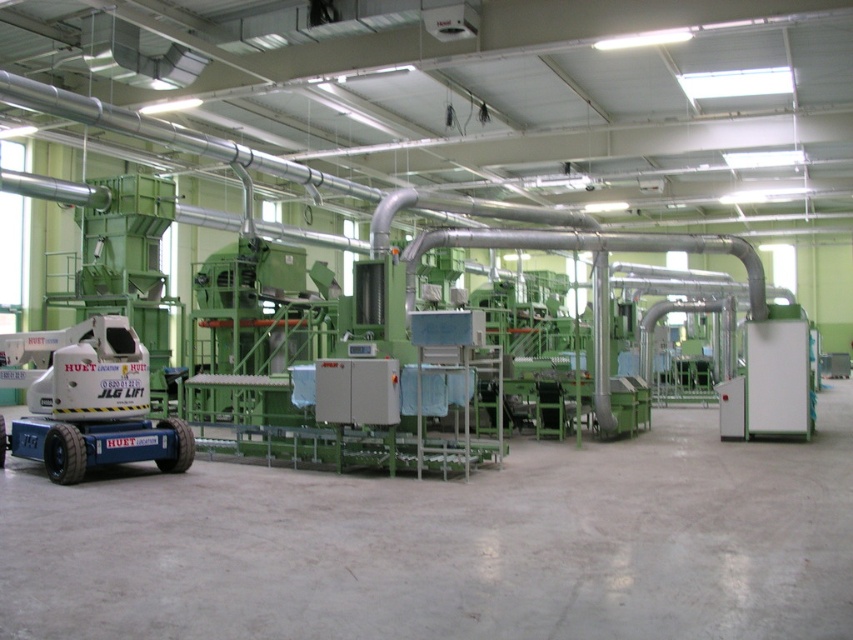
Is point (56, 392) in front of point (717, 241)?

Yes, it is.

Does white plastic lift at left appear on the right side of metallic silver pipe at center?

No, white plastic lift at left is not to the right of metallic silver pipe at center.

Describe the element at coordinates (86, 401) in the screenshot. I see `white plastic lift at left` at that location.

This screenshot has height=640, width=853. In order to click on white plastic lift at left in this screenshot , I will do `click(86, 401)`.